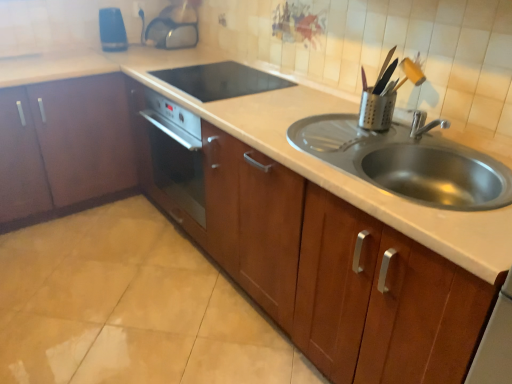
Question: In terms of width, does blue plastic electric outlet at upper center look wider or thinner when compared to transparent plastic kettle at upper center, placed as the fourth appliance when sorted from front to back?

Choices:
 (A) thin
 (B) wide

Answer: (A)

Question: Is blue plastic electric outlet at upper center taller or shorter than transparent plastic kettle at upper center, placed as the fourth appliance when sorted from front to back?

Choices:
 (A) short
 (B) tall

Answer: (A)

Question: Estimate the real-world distances between objects in this image. Which object is closer to the blue plastic toaster at upper left, which ranks as the second appliance in back-to-front order?

Choices:
 (A) black glass cooktop at center, which is the 3th appliance in left-to-right order
 (B) metallic silver utensil holder at upper right, which is the 4th appliance in left-to-right order
 (C) transparent plastic kettle at upper center, the second appliance when ordered from left to right
 (D) stainless steel sink at center
 (E) blue plastic electric outlet at upper center

Answer: (C)

Question: Estimate the real-world distances between objects in this image. Which object is farther from the transparent plastic kettle at upper center, placed as the fourth appliance when sorted from front to back?

Choices:
 (A) metallic silver utensil holder at upper right, acting as the first appliance starting from the front
 (B) black glass cooktop at center, which ranks as the 2th appliance in right-to-left order
 (C) blue plastic electric outlet at upper center
 (D) stainless steel sink at center
 (E) matte wood cabinet at left, the 2th cabinetry from the right

Answer: (D)